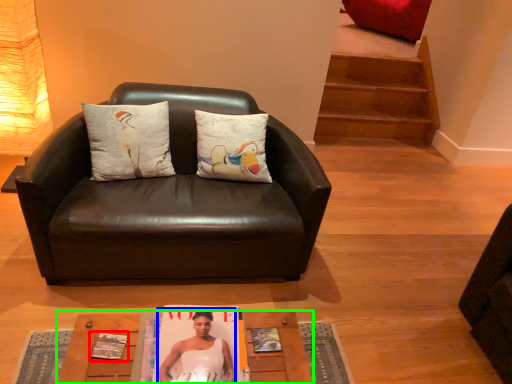
Question: Estimate the real-world distances between objects in this image. Which object is farther from magazine (highlighted by a red box), person (highlighted by a blue box) or table (highlighted by a green box)?

Choices:
 (A) person
 (B) table

Answer: (B)